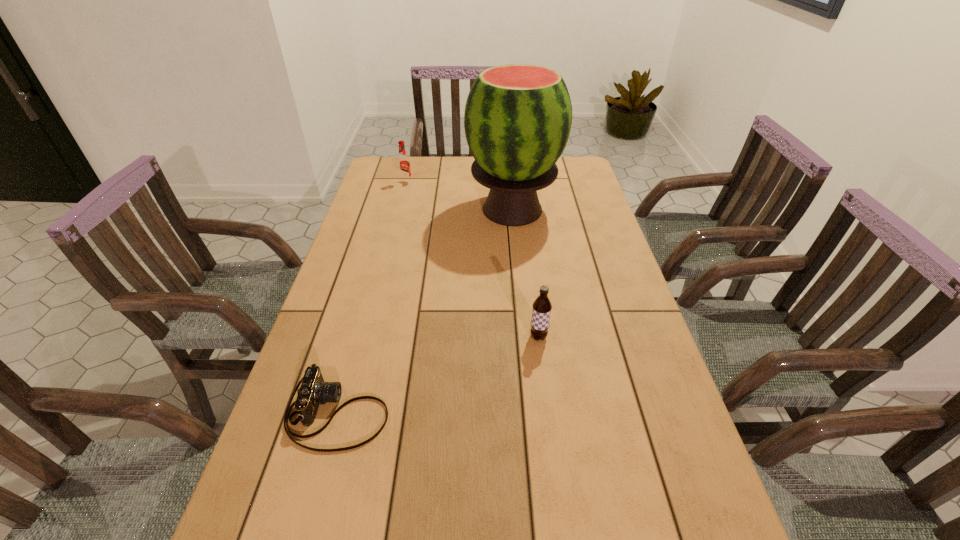
Identify the location of free space between the farther root beer and the nearer root beer. This screenshot has height=540, width=960. (472, 260).

Identify which object is the second nearest to the farthest object. Please provide its 2D coordinates. Your answer should be formatted as a tuple, i.e. [(x, y)], where the tuple contains the x and y coordinates of a point satisfying the conditions above.

[(541, 311)]

Identify the location of object that stands as the second closest to the left root beer. The width and height of the screenshot is (960, 540). (541, 311).

Find the location of a particular element. vacant point that satisfies the following two spatial constraints: 1. on the front side of the nearer root beer; 2. on the right side of the left root beer is located at coordinates (367, 337).